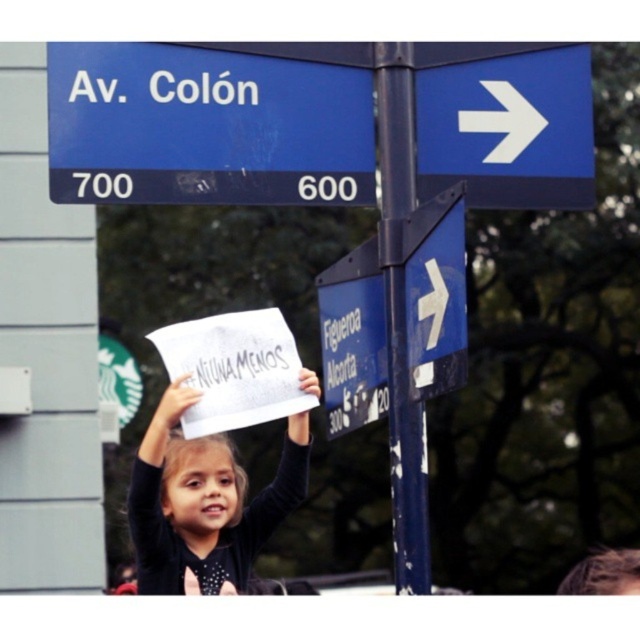
You are a delivery driver trying to navigate the streets of Buenos Aires. You see the blue plastic street sign at upper left and the blue plastic sign at center right. Which one is located higher up in the image?

The blue plastic street sign at upper left is positioned over the blue plastic sign at center right, so it is higher up in the image.

You are a photographer trying to capture the girl holding the sign. You notice two points marked in the image at coordinates point (541, 200) and point (364, 408). Which point is closer to the camera?

Point (364, 408) is closer to the camera since it is less further than point (541, 200).